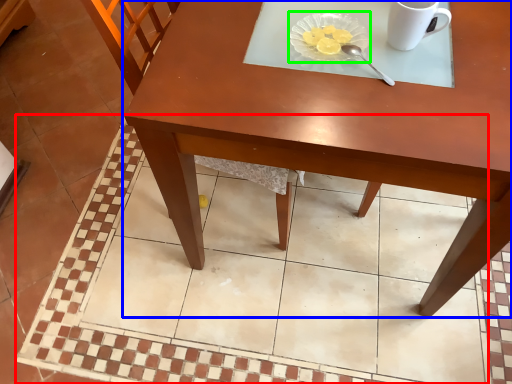
Question: Considering the real-world distances, which object is farthest from square (highlighted by a red box)? table (highlighted by a blue box) or glass plate (highlighted by a green box)?

Choices:
 (A) table
 (B) glass plate

Answer: (B)